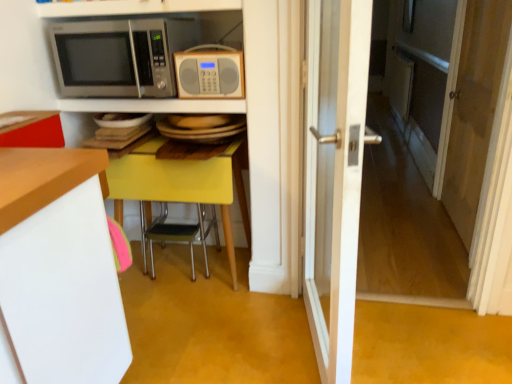
Where is `free spot in front of metallic yellow chair at center`? This screenshot has height=384, width=512. free spot in front of metallic yellow chair at center is located at coordinates (179, 302).